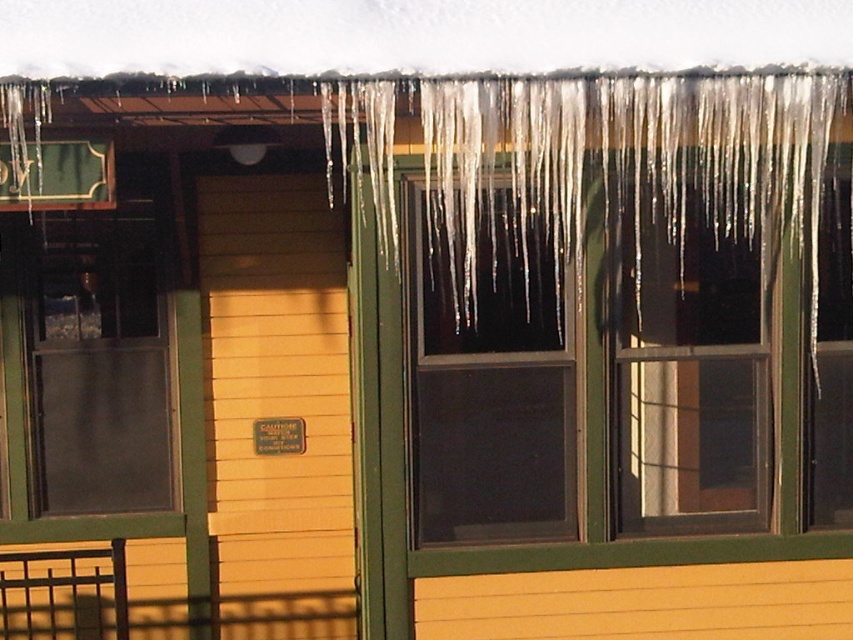
Question: Estimate the real-world distances between objects in this image. Which object is farther from the transparent glass window at left?

Choices:
 (A) transparent glass window at center
 (B) transparent glass window at upper center

Answer: (B)

Question: Does transparent glass window at upper center appear under transparent glass window at center?

Choices:
 (A) no
 (B) yes

Answer: (B)

Question: Which object is positioned closest to the transparent glass window at left?

Choices:
 (A) transparent glass window at center
 (B) transparent glass window at upper center

Answer: (A)

Question: Estimate the real-world distances between objects in this image. Which object is closer to the transparent glass window at upper center?

Choices:
 (A) transparent glass window at center
 (B) transparent glass window at left

Answer: (A)

Question: Can you confirm if transparent glass window at upper center is wider than transparent glass window at center?

Choices:
 (A) yes
 (B) no

Answer: (A)

Question: Can you confirm if transparent glass window at upper center is smaller than transparent glass window at left?

Choices:
 (A) no
 (B) yes

Answer: (A)